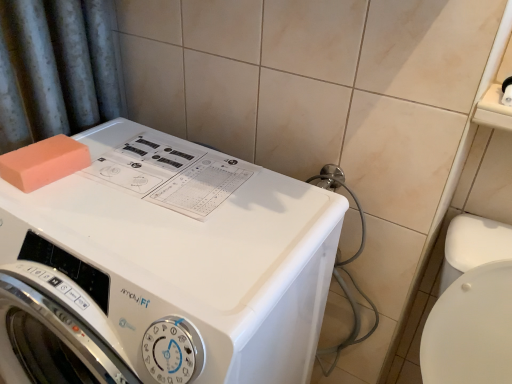
Find the location of a particular element. free space to the back side of orange matte sponge at top left is located at coordinates (106, 134).